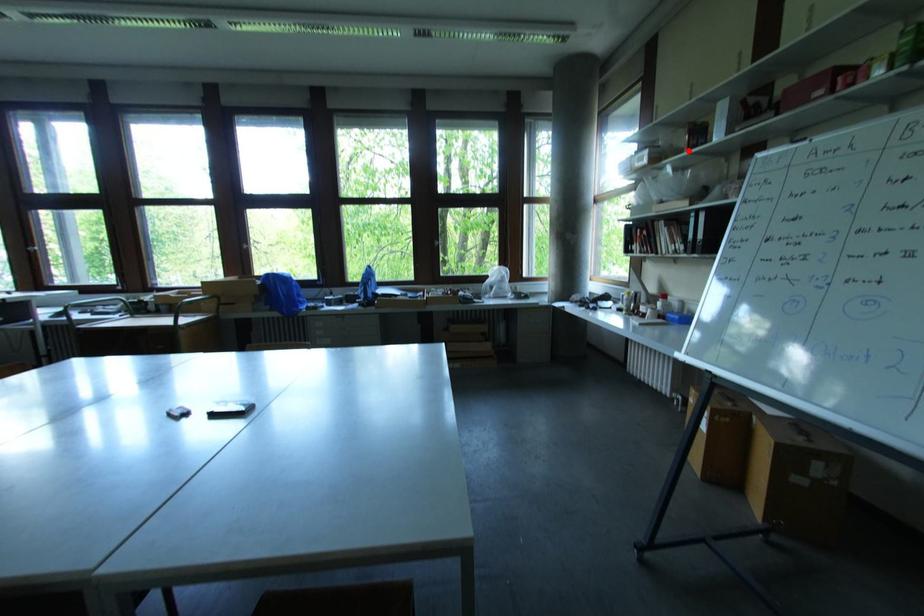
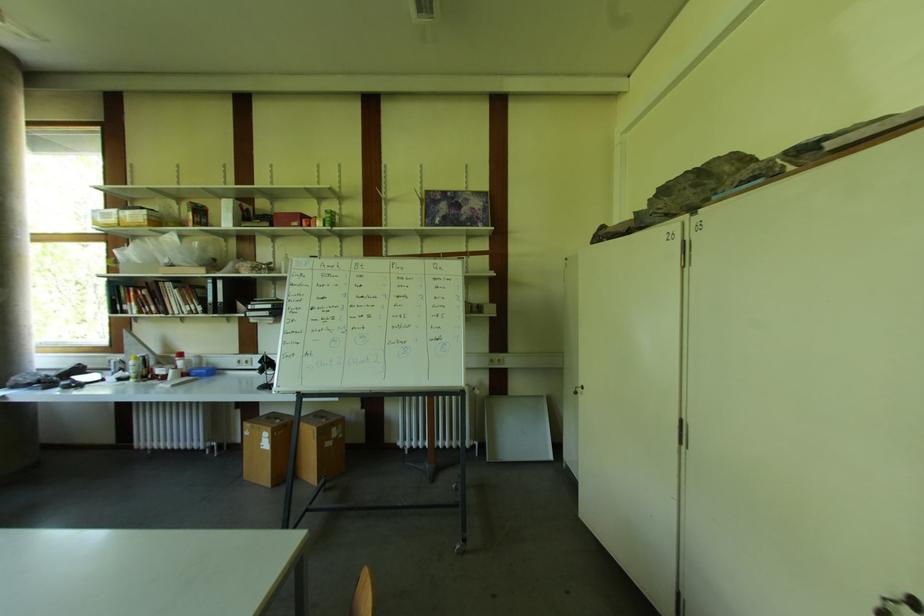
In the second image, find the point that corresponds to the highlighted location in the first image.

(193, 225)